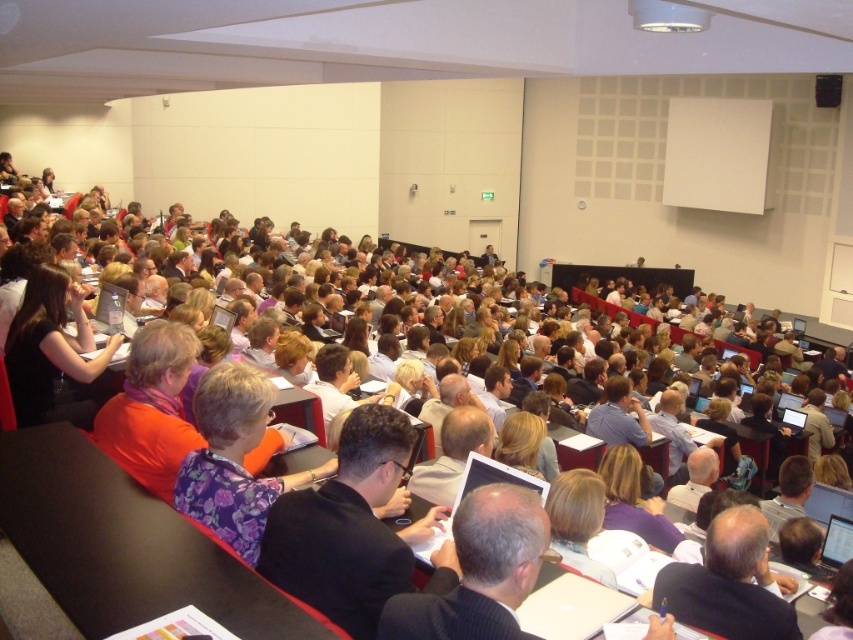
Question: Among these points, which one is nearest to the camera?

Choices:
 (A) (200, 428)
 (B) (352, 433)

Answer: (B)

Question: Which object appears closest to the camera in this image?

Choices:
 (A) dark suit at center
 (B) floral fabric shirt at center

Answer: (A)

Question: Does dark suit at center have a greater width compared to floral fabric shirt at center?

Choices:
 (A) yes
 (B) no

Answer: (A)

Question: Does dark suit at center have a greater width compared to floral fabric shirt at center?

Choices:
 (A) yes
 (B) no

Answer: (A)

Question: Is dark suit at center positioned at the back of floral fabric shirt at center?

Choices:
 (A) no
 (B) yes

Answer: (A)